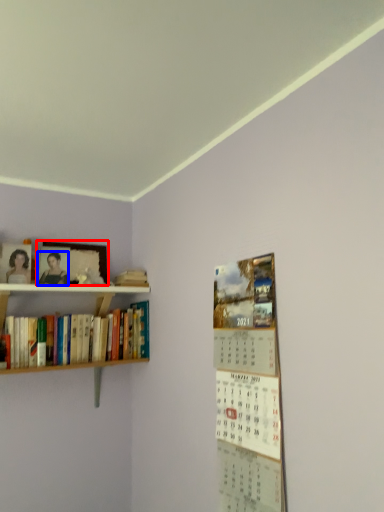
Question: Which object is closer to the camera taking this photo, picture frame (highlighted by a red box) or person (highlighted by a blue box)?

Choices:
 (A) picture frame
 (B) person

Answer: (B)